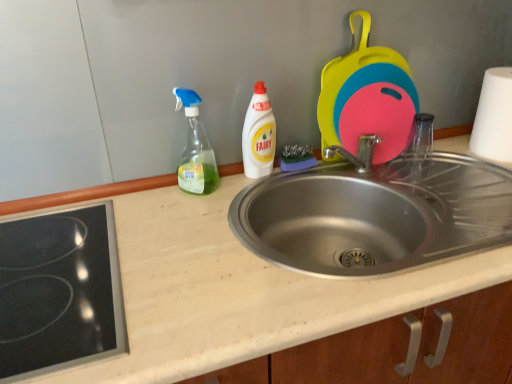
You are a GUI agent. You are given a task and a screenshot of the screen. Output one action in this format:
    pyautogui.click(x=<x>, y=<y>)
    Task: Click on the empty space that is ontop of black glass cooktop at lower left (from a real-world perspective)
    This screenshot has width=512, height=384.
    Given the screenshot: What is the action you would take?
    pyautogui.click(x=51, y=267)